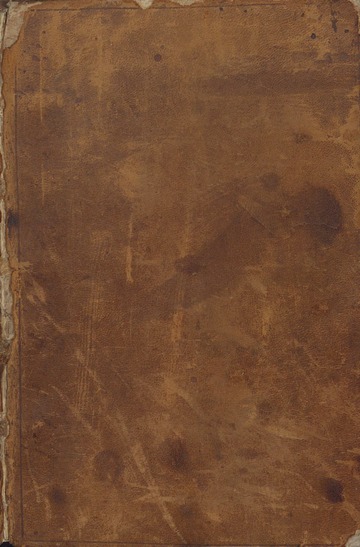
Where is `book`? The height and width of the screenshot is (547, 360). book is located at coordinates (227, 375).